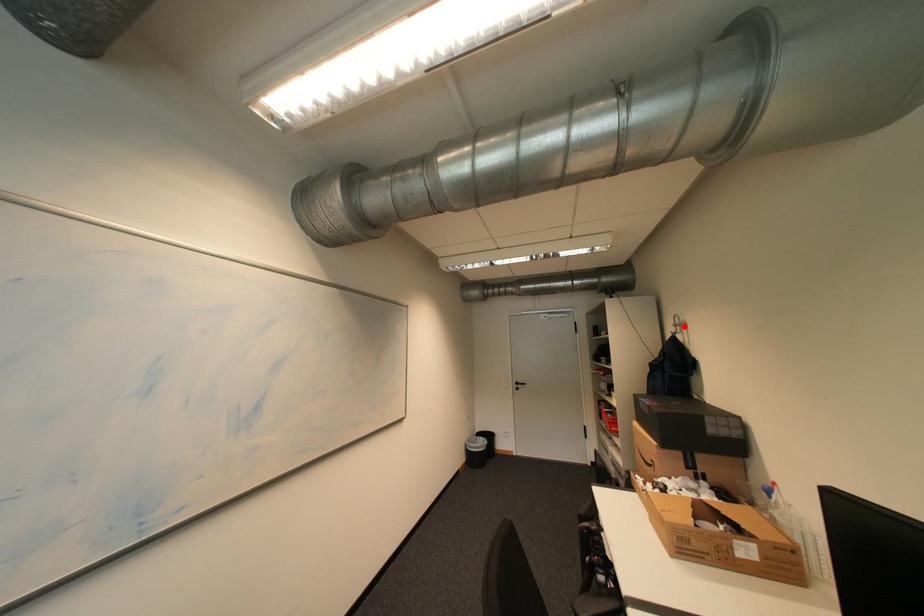
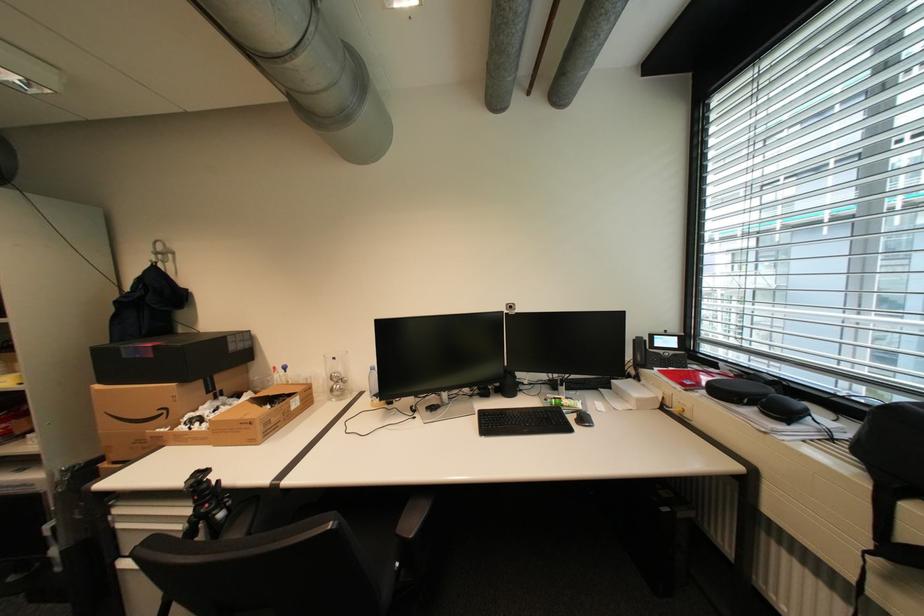
Find the pixel in the second image that matches the highlighted location in the first image.

(165, 254)